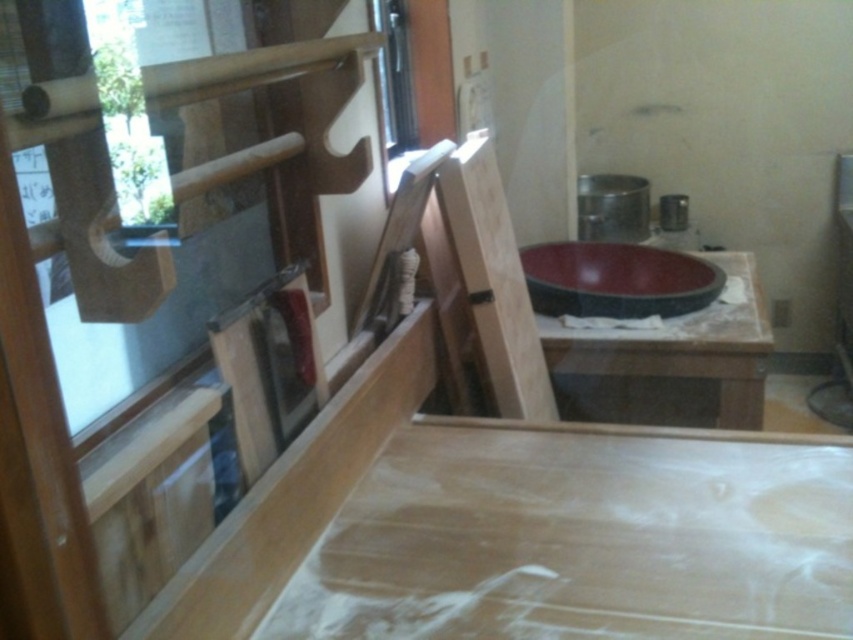
Question: Which object appears farthest from the camera in this image?

Choices:
 (A) matte black sink at center
 (B) matte black bowl at center

Answer: (A)

Question: Where is smooth light brown plywood at center located in relation to matte black sink at center in the image?

Choices:
 (A) below
 (B) above

Answer: (A)

Question: Which object appears farthest from the camera in this image?

Choices:
 (A) smooth light brown plywood at center
 (B) matte black sink at center
 (C) matte black bowl at center

Answer: (B)

Question: Is smooth light brown plywood at center behind matte black bowl at center?

Choices:
 (A) yes
 (B) no

Answer: (B)

Question: Is matte black bowl at center above matte black sink at center?

Choices:
 (A) yes
 (B) no

Answer: (B)

Question: Which is farther from the smooth light brown plywood at center?

Choices:
 (A) matte black sink at center
 (B) matte black bowl at center

Answer: (A)